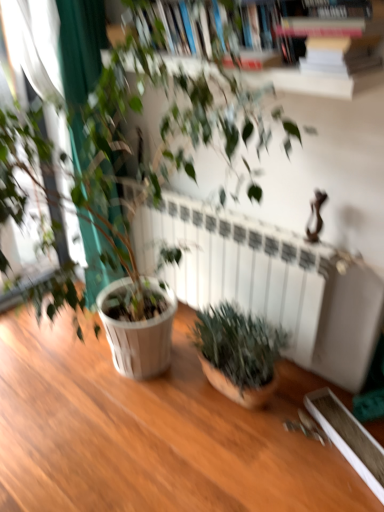
Describe the element at coordinates (324, 55) in the screenshot. I see `wooden bookcase at upper center` at that location.

Where is `wooden bookcase at upper center`? This screenshot has height=512, width=384. wooden bookcase at upper center is located at coordinates (324, 55).

Between white matte radiator at center and green matte plant at center, acting as the second houseplant starting from the bottom, which one appears on the left side from the viewer's perspective?

green matte plant at center, acting as the second houseplant starting from the bottom.

From the image's perspective, is white matte radiator at center on green matte plant at center, acting as the second houseplant starting from the bottom?

No.

Is white matte radiator at center behind green matte plant at center, acting as the second houseplant starting from the bottom?

Yes, white matte radiator at center is behind green matte plant at center, acting as the second houseplant starting from the bottom.

Identify the location of houseplant on the left of white matte radiator at center. pos(125,140).

Which object is wider, white matte radiator at center or green matte plant at lower right, positioned as the 1th houseplant in bottom-to-top order?

green matte plant at lower right, positioned as the 1th houseplant in bottom-to-top order, is wider.

In the scene shown: How many degrees apart are the facing directions of white matte radiator at center and green matte plant at lower right, the second houseplant from the top?

The angular difference between white matte radiator at center and green matte plant at lower right, the second houseplant from the top, is 3.6 degrees.

Which is behind, point (303, 251) or point (271, 357)?

The point (271, 357) is farther from the camera.

In the scene shown: How many degrees apart are the facing directions of wooden bookcase at upper center and white matte radiator at center?

The angle between the facing direction of wooden bookcase at upper center and the facing direction of white matte radiator at center is 0.474 degrees.

Considering the positions of objects wooden bookcase at upper center and white matte radiator at center in the image provided, who is more to the right, wooden bookcase at upper center or white matte radiator at center?

white matte radiator at center is more to the right.

Is wooden bookcase at upper center positioned with its back to white matte radiator at center?

No, wooden bookcase at upper center is not facing away from white matte radiator at center.

Which point is more distant from viewer, (x=370, y=69) or (x=234, y=247)?

The point (x=234, y=247) is more distant.

From the image's perspective, does green matte plant at center, which is the 1th houseplant in top-to-bottom order, appear lower than green matte plant at lower right, positioned as the 1th houseplant in bottom-to-top order?

Actually, green matte plant at center, which is the 1th houseplant in top-to-bottom order, appears above green matte plant at lower right, positioned as the 1th houseplant in bottom-to-top order, in the image.

Looking at this image, considering the relative positions of green matte plant at center, which is the 1th houseplant in top-to-bottom order, and green matte plant at lower right, the second houseplant from the top, in the image provided, is green matte plant at center, which is the 1th houseplant in top-to-bottom order, to the left of green matte plant at lower right, the second houseplant from the top, from the viewer's perspective?

Yes.

Can you confirm if green matte plant at center, acting as the second houseplant starting from the bottom, is taller than green matte plant at lower right, the second houseplant from the top?

Yes.

Is green matte plant at center, which is the 1th houseplant in top-to-bottom order, wider or thinner than green matte plant at lower right, the second houseplant from the top?

Clearly, green matte plant at center, which is the 1th houseplant in top-to-bottom order, has more width compared to green matte plant at lower right, the second houseplant from the top.

Is green matte plant at lower right, the second houseplant from the top, inside the boundaries of white matte radiator at center, or outside?

green matte plant at lower right, the second houseplant from the top, is not enclosed by white matte radiator at center.

Does green matte plant at lower right, positioned as the 1th houseplant in bottom-to-top order, appear on the left side of white matte radiator at center?

In fact, green matte plant at lower right, positioned as the 1th houseplant in bottom-to-top order, is to the right of white matte radiator at center.

Can you confirm if green matte plant at lower right, the second houseplant from the top, is wider than white matte radiator at center?

Yes.

Which point is more distant from viewer, (241, 360) or (279, 287)?

The point (279, 287) is more distant.

Between green matte plant at center, which is the 1th houseplant in top-to-bottom order, and white matte radiator at center, which one appears on the left side from the viewer's perspective?

green matte plant at center, which is the 1th houseplant in top-to-bottom order.

Is green matte plant at center, which is the 1th houseplant in top-to-bottom order, inside or outside of white matte radiator at center?

green matte plant at center, which is the 1th houseplant in top-to-bottom order, cannot be found inside white matte radiator at center.

From the picture: How far apart are green matte plant at center, acting as the second houseplant starting from the bottom, and white matte radiator at center?

green matte plant at center, acting as the second houseplant starting from the bottom, is 17.01 inches from white matte radiator at center.

From the image's perspective, is green matte plant at center, which is the 1th houseplant in top-to-bottom order, over white matte radiator at center?

Yes, from the image's perspective, green matte plant at center, which is the 1th houseplant in top-to-bottom order, is above white matte radiator at center.

Find the location of `bookcase located in front of the green matte plant at lower right, the second houseplant from the top`. bookcase located in front of the green matte plant at lower right, the second houseplant from the top is located at coordinates pyautogui.click(x=324, y=55).

Looking at this image, is wooden bookcase at upper center closer to camera compared to green matte plant at lower right, the second houseplant from the top?

That is True.

Looking at this image, in terms of height, does wooden bookcase at upper center look taller or shorter compared to green matte plant at lower right, positioned as the 1th houseplant in bottom-to-top order?

wooden bookcase at upper center is shorter than green matte plant at lower right, positioned as the 1th houseplant in bottom-to-top order.

Is point (367, 78) farther from viewer compared to point (206, 319)?

No, (367, 78) is in front of (206, 319).

Find the location of a particular element. This screenshot has height=512, width=384. radiator that appears below the green matte plant at center, acting as the second houseplant starting from the bottom (from a real-world perspective) is located at coordinates (238, 266).

Locate an element on the screen. Image resolution: width=384 pixels, height=512 pixels. houseplant to the right of white matte radiator at center is located at coordinates (238, 353).

Which object lies further to the anchor point white matte radiator at center, wooden bookcase at upper center or green matte plant at lower right, positioned as the 1th houseplant in bottom-to-top order?

Among the two, wooden bookcase at upper center is located further to white matte radiator at center.

When comparing their distances from green matte plant at center, which is the 1th houseplant in top-to-bottom order, does wooden bookcase at upper center or white matte radiator at center seem closer?

The object closer to green matte plant at center, which is the 1th houseplant in top-to-bottom order, is white matte radiator at center.

From the image, which object appears to be nearer to green matte plant at center, which is the 1th houseplant in top-to-bottom order, white matte radiator at center or wooden bookcase at upper center?

white matte radiator at center is closer to green matte plant at center, which is the 1th houseplant in top-to-bottom order.

Which object lies further to the anchor point white matte radiator at center, green matte plant at center, acting as the second houseplant starting from the bottom, or green matte plant at lower right, positioned as the 1th houseplant in bottom-to-top order?

green matte plant at center, acting as the second houseplant starting from the bottom, is positioned further to the anchor white matte radiator at center.

Considering their positions, is white matte radiator at center positioned closer to green matte plant at center, which is the 1th houseplant in top-to-bottom order, than green matte plant at lower right, the second houseplant from the top?

Among the two, white matte radiator at center is located nearer to green matte plant at center, which is the 1th houseplant in top-to-bottom order.

Considering their positions, is wooden bookcase at upper center positioned further to green matte plant at center, acting as the second houseplant starting from the bottom, than green matte plant at lower right, the second houseplant from the top?

green matte plant at lower right, the second houseplant from the top, is further to green matte plant at center, acting as the second houseplant starting from the bottom.

Considering their positions, is green matte plant at lower right, positioned as the 1th houseplant in bottom-to-top order, positioned closer to green matte plant at center, acting as the second houseplant starting from the bottom, than wooden bookcase at upper center?

wooden bookcase at upper center.

Looking at the image, which one is located closer to wooden bookcase at upper center, green matte plant at lower right, positioned as the 1th houseplant in bottom-to-top order, or green matte plant at center, acting as the second houseplant starting from the bottom?

green matte plant at center, acting as the second houseplant starting from the bottom, is positioned closer to the anchor wooden bookcase at upper center.

Locate an element on the screen. Image resolution: width=384 pixels, height=512 pixels. radiator between wooden bookcase at upper center and green matte plant at lower right, the second houseplant from the top, from top to bottom is located at coordinates (238, 266).

At what (x,y) coordinates should I click in order to perform the action: click on houseplant between green matte plant at center, acting as the second houseplant starting from the bottom, and white matte radiator at center from front to back. Please return your answer as a coordinate pair (x, y). The height and width of the screenshot is (512, 384). Looking at the image, I should click on (238, 353).

You are a GUI agent. You are given a task and a screenshot of the screen. Output one action in this format:
    pyautogui.click(x=<x>, y=<y>)
    Task: Click on the bookcase between green matte plant at center, which is the 1th houseplant in top-to-bottom order, and green matte plant at lower right, positioned as the 1th houseplant in bottom-to-top order, in the front-back direction
    
    Given the screenshot: What is the action you would take?
    pyautogui.click(x=324, y=55)

Identify the location of bookcase between green matte plant at center, which is the 1th houseplant in top-to-bottom order, and white matte radiator at center from front to back. (324, 55).